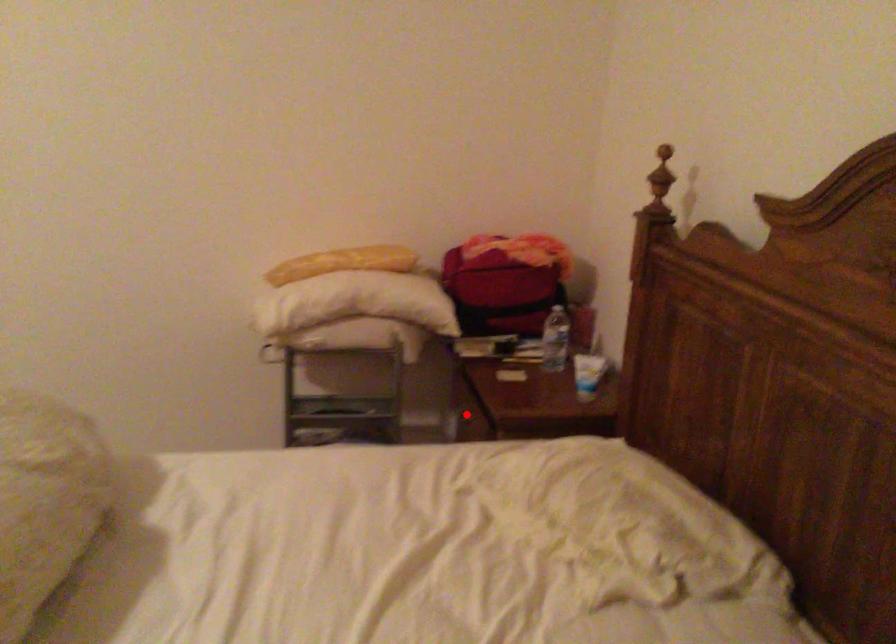
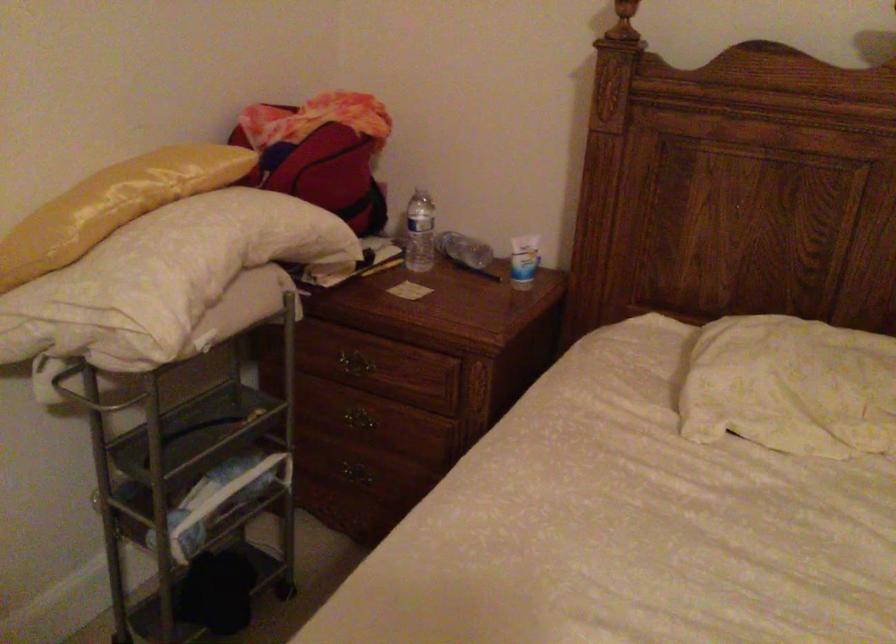
In the second image, find the point that corresponds to the highlighted location in the first image.

(350, 365)